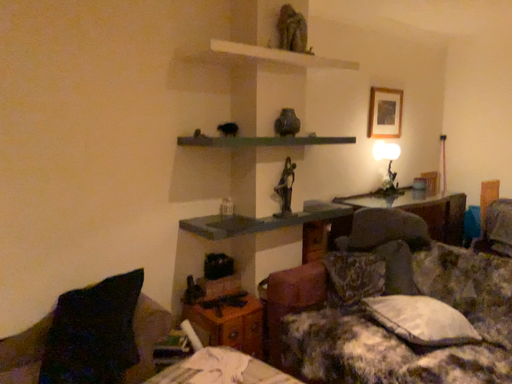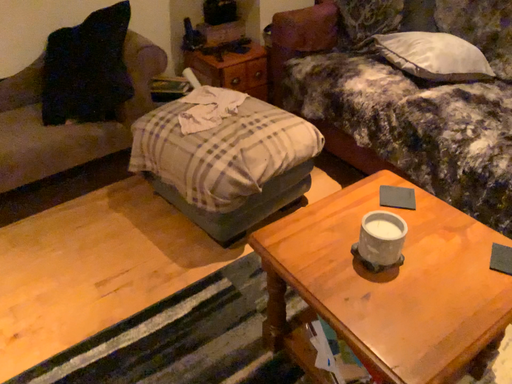
Question: How did the camera likely rotate when shooting the video?

Choices:
 (A) rotated upward
 (B) rotated downward

Answer: (B)